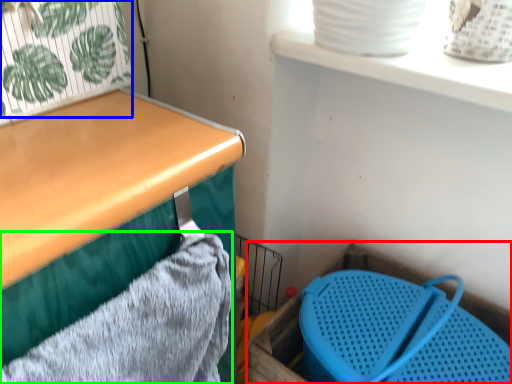
Question: Which object is the farthest from storage box (highlighted by a red box)? Choose among these: plant (highlighted by a blue box) or bath towel (highlighted by a green box).

Choices:
 (A) plant
 (B) bath towel

Answer: (A)